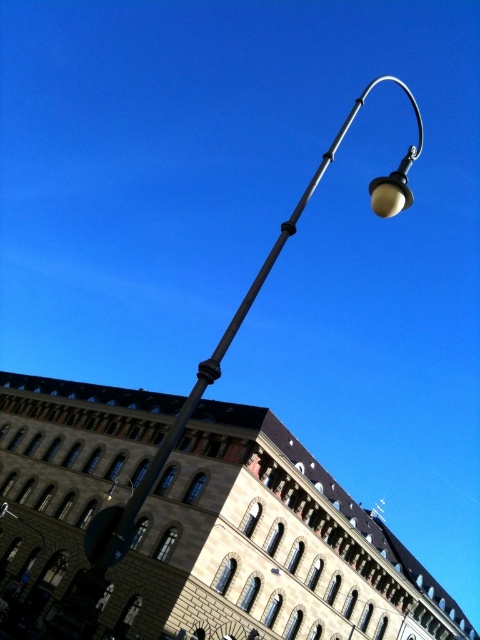
Which is more to the left, matte black street light at upper center or matte black streetlamp at upper center?

matte black streetlamp at upper center

Which is behind, point (255, 291) or point (112, 486)?

Point (255, 291)

Measure the distance between point (393, 188) and camera.

17.21 meters

This screenshot has width=480, height=640. I want to click on matte black street light at upper center, so click(x=231, y=340).